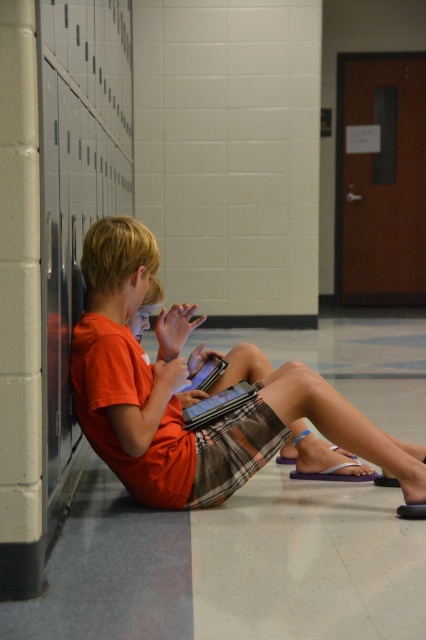
You are standing in the school hallway and want to reach the point marked at coordinates (88, 358). If you take three steps forward, each step covering 3 feet, will you reach that point?

The distance between you and the point is 9.27 feet. Taking three steps of 3 feet each would cover 9 feet total. Since 9 feet is less than 9.27 feet, you would not quite reach the point after three steps.